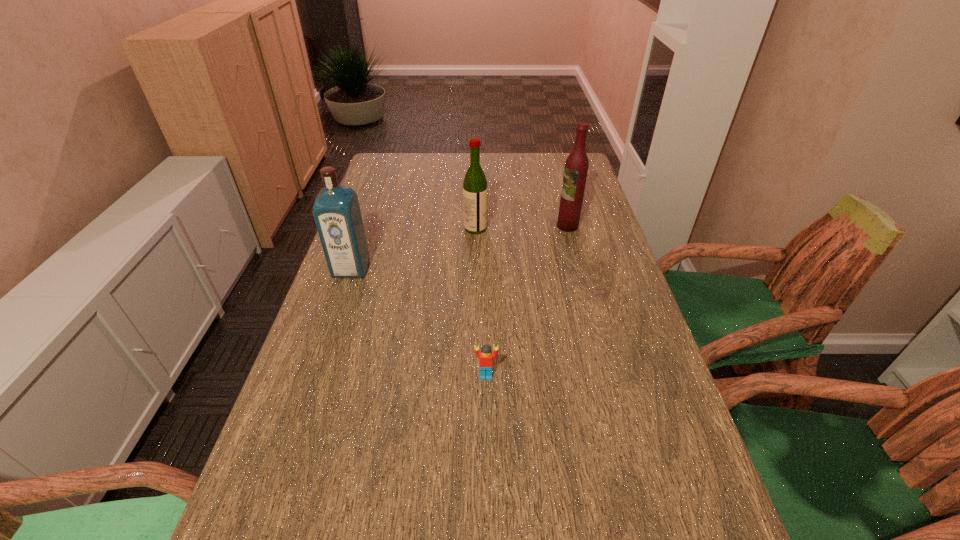
I want to click on free space between the rightmost liquor and the Lego, so click(527, 301).

This screenshot has width=960, height=540. Identify the location of free space between the second liquor from left to right and the rightmost object. (521, 227).

Where is `unoccupied area between the second liquor from right to left and the leftmost object`? unoccupied area between the second liquor from right to left and the leftmost object is located at coordinates (414, 248).

You are a GUI agent. You are given a task and a screenshot of the screen. Output one action in this format:
    pyautogui.click(x=<x>, y=<y>)
    Task: Click on the empty space between the leftmost liquor and the nearest object
    The image size is (960, 540).
    Given the screenshot: What is the action you would take?
    pyautogui.click(x=419, y=322)

Locate an element on the screen. The image size is (960, 540). free spot between the shortest object and the rightmost liquor is located at coordinates (527, 301).

The width and height of the screenshot is (960, 540). Identify the location of vacant space that is in between the nearest object and the leftmost object. (419, 322).

Find the location of a particular element. vacant area that lies between the Lego and the leftmost liquor is located at coordinates (419, 322).

Identify which object is the third closest to the shortest object. Please provide its 2D coordinates. Your answer should be formatted as a tuple, i.e. [(x, y)], where the tuple contains the x and y coordinates of a point satisfying the conditions above.

[(576, 166)]

Point out which object is positioned as the third nearest to the third farthest object. Please provide its 2D coordinates. Your answer should be formatted as a tuple, i.e. [(x, y)], where the tuple contains the x and y coordinates of a point satisfying the conditions above.

[(576, 166)]

Where is `liquor that is the closest one to the nearest liquor`? This screenshot has height=540, width=960. liquor that is the closest one to the nearest liquor is located at coordinates tap(475, 190).